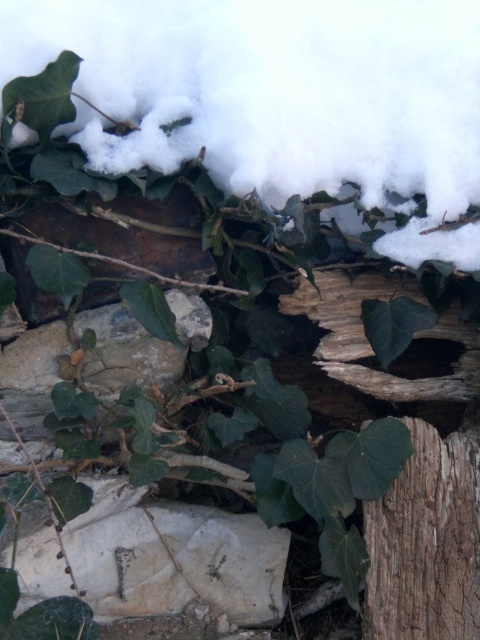
Question: Is white fluffy snow at upper center to the right of smooth brown wood at center from the viewer's perspective?

Choices:
 (A) no
 (B) yes

Answer: (A)

Question: Which point appears closest to the camera in this image?

Choices:
 (A) (479, 468)
 (B) (81, 20)

Answer: (B)

Question: Considering the relative positions of white fluffy snow at upper center and smooth brown wood at center in the image provided, where is white fluffy snow at upper center located with respect to smooth brown wood at center?

Choices:
 (A) right
 (B) left

Answer: (B)

Question: Can you confirm if white fluffy snow at upper center is positioned to the right of smooth brown wood at center?

Choices:
 (A) yes
 (B) no

Answer: (B)

Question: Which of the following is the closest to the observer?

Choices:
 (A) smooth brown wood at center
 (B) white fluffy snow at upper center

Answer: (B)